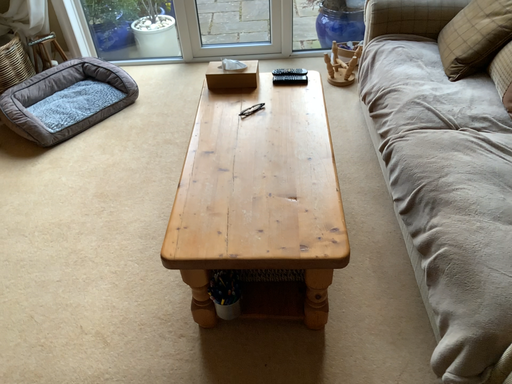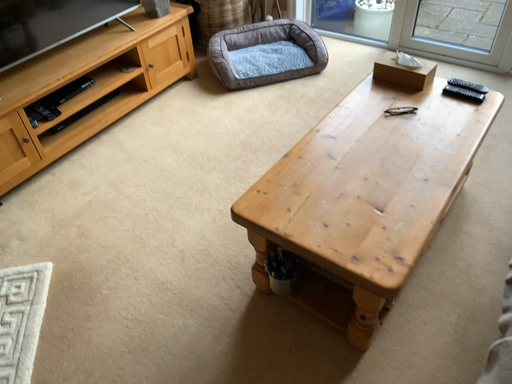
Question: Which way did the camera rotate in the video?

Choices:
 (A) rotated left
 (B) rotated right

Answer: (A)